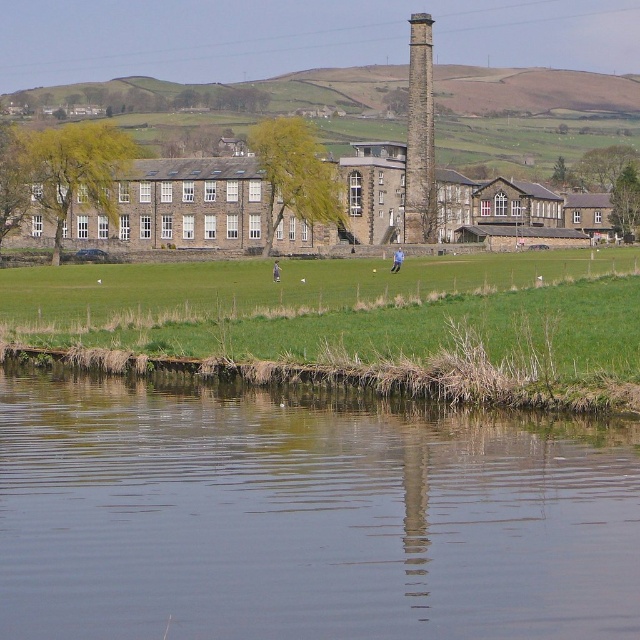
Question: Among these objects, which one is nearest to the camera?

Choices:
 (A) transparent water at lower center
 (B) smooth stone chimney at upper center

Answer: (A)

Question: Can you confirm if transparent water at lower center is bigger than smooth stone chimney at upper center?

Choices:
 (A) yes
 (B) no

Answer: (A)

Question: Among these objects, which one is farthest from the camera?

Choices:
 (A) smooth stone chimney at upper center
 (B) transparent water at lower center

Answer: (A)

Question: Does transparent water at lower center appear over smooth stone chimney at upper center?

Choices:
 (A) yes
 (B) no

Answer: (B)

Question: Can you confirm if transparent water at lower center is positioned below smooth stone chimney at upper center?

Choices:
 (A) no
 (B) yes

Answer: (B)